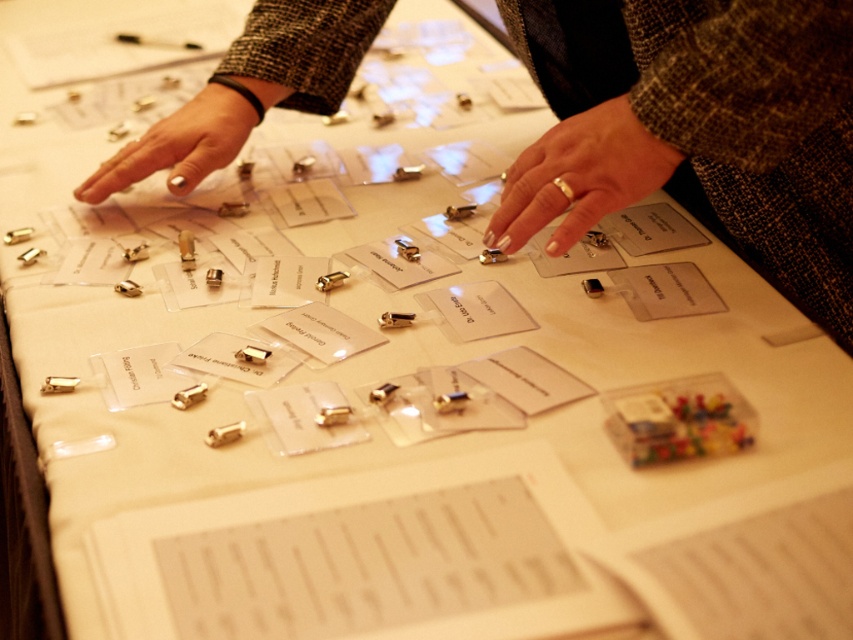
You are organizing items on a table for a craft fair. You have a silver metallic ring at center and a nail polish at center. Which item should you place in the smaller display box if you want to ensure it fits properly?

The silver metallic ring at center is smaller than the nail polish at center, so it should be placed in the smaller display box to ensure it fits properly.

You are organizing items on a table and notice the silver metallic ring at center and the nail polish at center. Which item is located to the right of the other?

The silver metallic ring at center is positioned on the right side of nail polish at center.

You have a small container that can only hold items narrower than 2 cm. You need to place either the silver metallic ring at center or the nail polish at center into it. Which item can fit?

The silver metallic ring at center can fit into the container since its width is less than 2 cm, while the nail polish at center is wider and cannot fit.